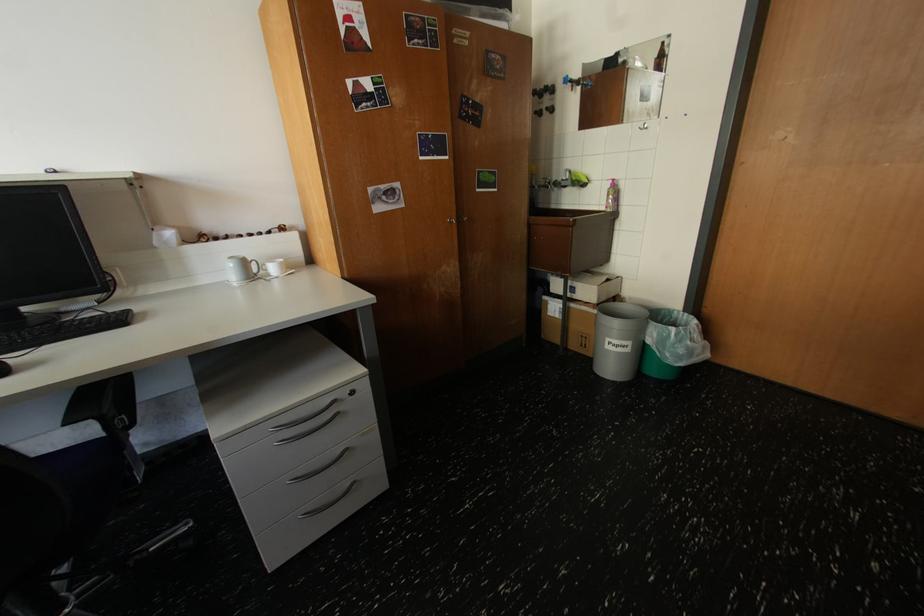
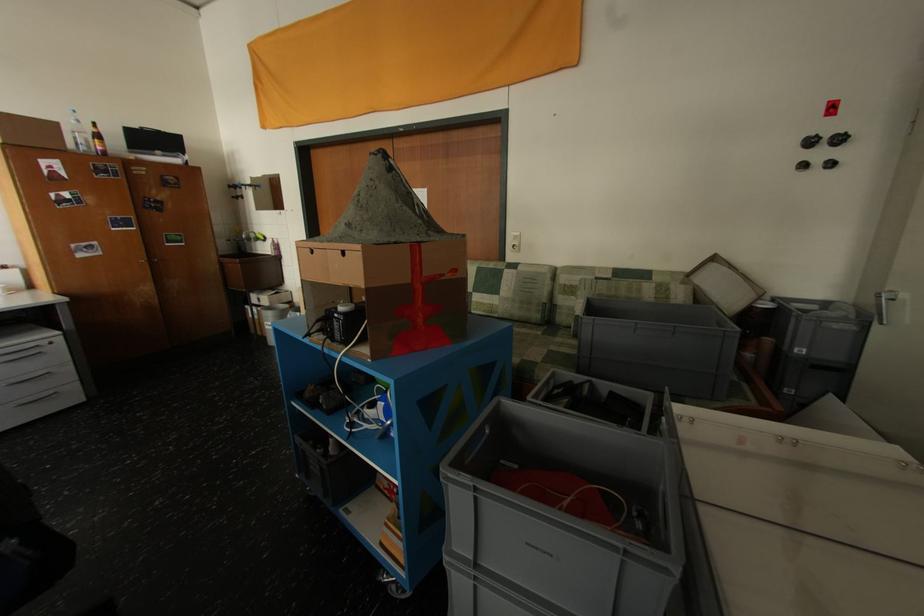
What movement of the cameraman would produce the second image?

The cameraman walked toward right, backward.